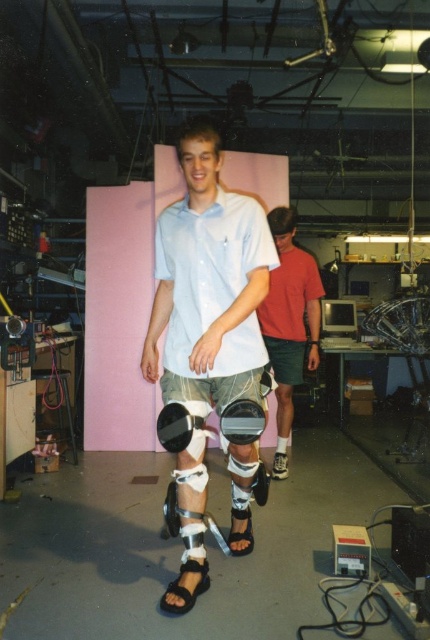
Is white matte knee brace at center above matte white shorts at center?

No.

Is point (187, 176) closer to camera compared to point (310, 314)?

Yes, point (187, 176) is closer to viewer.

Who is more distant from viewer, [249,244] or [279,432]?

The point [279,432] is more distant.

Identify the location of white matte knee brace at center. Image resolution: width=430 pixels, height=640 pixels. (208, 285).

Can you confirm if matte white shirt at center is thinner than matte black knee pad at center?

No, matte white shirt at center is not thinner than matte black knee pad at center.

Which of these two, matte white shirt at center or matte black knee pad at center, stands shorter?

Standing shorter between the two is matte black knee pad at center.

Is point (212, 232) positioned after point (260, 410)?

Yes.

The width and height of the screenshot is (430, 640). I want to click on matte white shirt at center, so click(211, 278).

This screenshot has width=430, height=640. Describe the element at coordinates (208, 285) in the screenshot. I see `white matte knee brace at center` at that location.

Can you confirm if white matte knee brace at center is positioned to the left of matte white shirt at center?

No, white matte knee brace at center is not to the left of matte white shirt at center.

In the scene shown: Who is more forward, (159, 257) or (245, 230)?

Point (245, 230)

Locate an element on the screen. Image resolution: width=430 pixels, height=640 pixels. white matte knee brace at center is located at coordinates (208, 285).